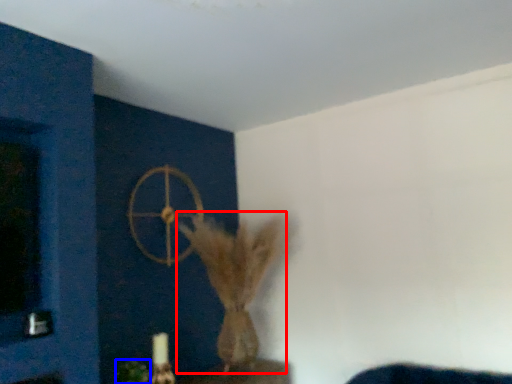
Question: Which object is closer to the camera taking this photo, animal (highlighted by a red box) or plant (highlighted by a blue box)?

Choices:
 (A) animal
 (B) plant

Answer: (B)